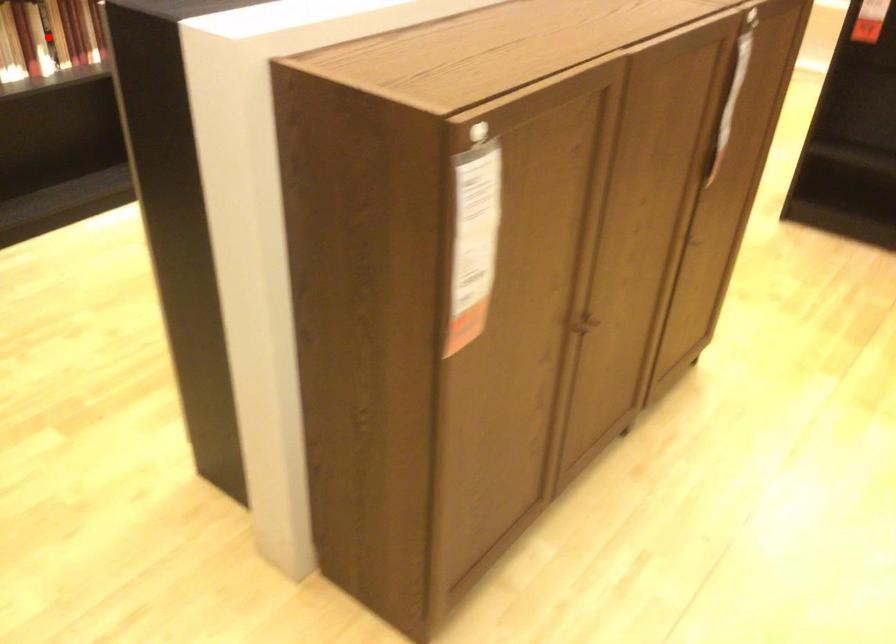
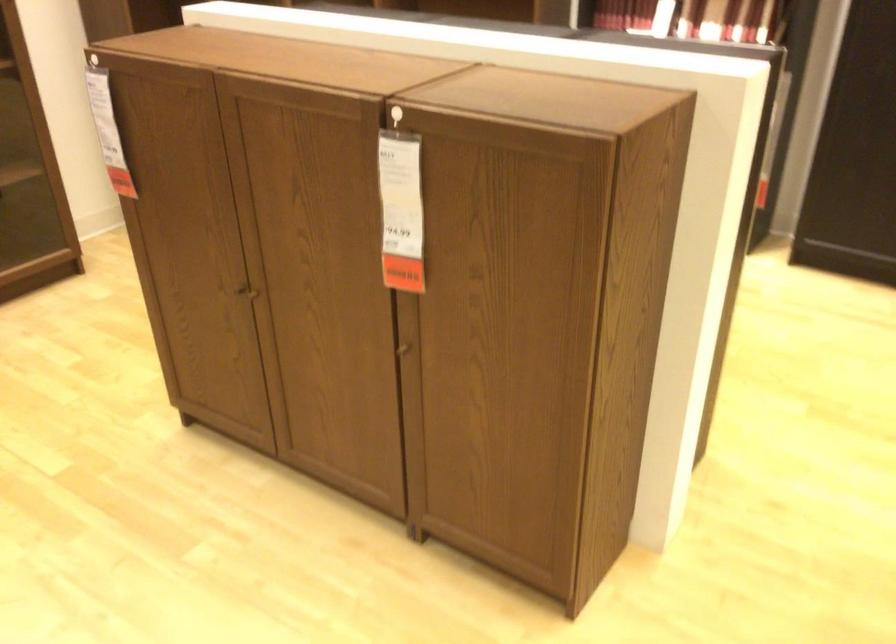
Question: I am providing you with two images of the same scene from different viewpoints. A red point is marked on the first image. Can you still see the location of the red point in image 2?

Choices:
 (A) Yes
 (B) No

Answer: (B)